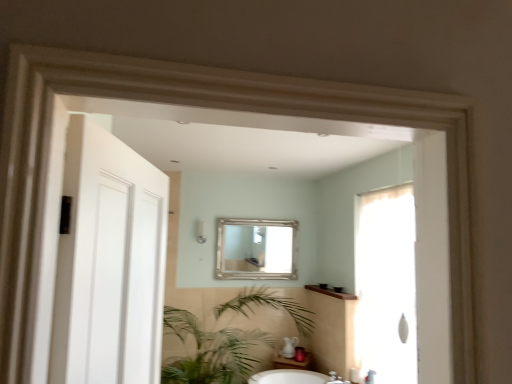
The height and width of the screenshot is (384, 512). What do you see at coordinates (387, 283) in the screenshot?
I see `translucent fabric screen door at right` at bounding box center [387, 283].

Where is `silver metallic mirror at center`? This screenshot has height=384, width=512. silver metallic mirror at center is located at coordinates [x=258, y=248].

Identify the location of green leafy plant at lower center. (211, 351).

Does silver metallic mirror at center have a greater height compared to green leafy plant at lower center?

Incorrect, the height of silver metallic mirror at center is not larger of that of green leafy plant at lower center.

Image resolution: width=512 pixels, height=384 pixels. In order to click on houseplant below the silver metallic mirror at center (from the image's perspective) in this screenshot , I will do `click(211, 351)`.

From the image's perspective, is silver metallic mirror at center positioned above or below green leafy plant at lower center?

silver metallic mirror at center is situated higher than green leafy plant at lower center in the image.

From a real-world perspective, which object stands above the other?

white matte door at left, from a real-world perspective.

Is translucent fabric screen door at right positioned with its back to white matte door at left?

No, translucent fabric screen door at right's orientation is not away from white matte door at left.

Considering the points (390, 292) and (82, 329), which point is in front, point (390, 292) or point (82, 329)?

Point (82, 329)

Can you confirm if translucent fabric screen door at right is positioned to the left of white matte door at left?

No, translucent fabric screen door at right is not to the left of white matte door at left.

Is white matte door at left bigger than silver metallic mirror at center?

Yes, white matte door at left is bigger than silver metallic mirror at center.

The height and width of the screenshot is (384, 512). Identify the location of door below the silver metallic mirror at center (from a real-world perspective). (109, 263).

Considering the sizes of objects white matte door at left and silver metallic mirror at center in the image provided, who is thinner, white matte door at left or silver metallic mirror at center?

Thinner between the two is silver metallic mirror at center.

From a real-world perspective, which object stands above the other?

silver metallic mirror at center.

Which of these two, translucent fabric screen door at right or silver metallic mirror at center, is bigger?

translucent fabric screen door at right.

Considering the positions of objects translucent fabric screen door at right and silver metallic mirror at center in the image provided, who is in front, translucent fabric screen door at right or silver metallic mirror at center?

Positioned in front is translucent fabric screen door at right.

Looking at this image, is silver metallic mirror at center surrounded by translucent fabric screen door at right?

Definitely not — silver metallic mirror at center is not inside translucent fabric screen door at right.

Which object is positioned more to the left, translucent fabric screen door at right or silver metallic mirror at center?

silver metallic mirror at center is more to the left.

Which is less distant, (284, 235) or (381, 266)?

Point (284, 235) is positioned farther from the camera compared to point (381, 266).

Is silver metallic mirror at center bigger than translucent fabric screen door at right?

No, silver metallic mirror at center is not bigger than translucent fabric screen door at right.

Is silver metallic mirror at center facing away from translucent fabric screen door at right?

No, silver metallic mirror at center is not facing the opposite direction of translucent fabric screen door at right.

Would you say silver metallic mirror at center is outside translucent fabric screen door at right?

That's correct, silver metallic mirror at center is outside of translucent fabric screen door at right.

Which of these two, white matte door at left or translucent fabric screen door at right, stands taller?

translucent fabric screen door at right is taller.

The height and width of the screenshot is (384, 512). What are the coordinates of `screen door behind the white matte door at left` in the screenshot? It's located at (387, 283).

Looking at this image, which object is positioned more to the left, white matte door at left or translucent fabric screen door at right?

white matte door at left.

From a real-world perspective, who is located higher, white matte door at left or translucent fabric screen door at right?

white matte door at left.

Is white matte door at left surrounded by silver metallic mirror at center?

No, white matte door at left is not a part of silver metallic mirror at center.

Can you see silver metallic mirror at center touching white matte door at left?

silver metallic mirror at center and white matte door at left are clearly separated.

Which of these two, silver metallic mirror at center or white matte door at left, stands shorter?

silver metallic mirror at center.

Does point (281, 231) come in front of point (150, 354)?

No, it is behind (150, 354).

Image resolution: width=512 pixels, height=384 pixels. I want to click on houseplant in front of the silver metallic mirror at center, so click(x=211, y=351).

Where is `screen door directly beneath the white matte door at left (from a real-world perspective)`? The width and height of the screenshot is (512, 384). screen door directly beneath the white matte door at left (from a real-world perspective) is located at coordinates pos(387,283).

From the image, which object appears to be nearer to green leafy plant at lower center, translucent fabric screen door at right or silver metallic mirror at center?

silver metallic mirror at center lies closer to green leafy plant at lower center than the other object.

From the image, which object appears to be nearer to white matte door at left, silver metallic mirror at center or green leafy plant at lower center?

green leafy plant at lower center is closer to white matte door at left.

From the image, which object appears to be farther from translucent fabric screen door at right, green leafy plant at lower center or white matte door at left?

The object further to translucent fabric screen door at right is white matte door at left.

From the image, which object appears to be nearer to silver metallic mirror at center, white matte door at left or translucent fabric screen door at right?

translucent fabric screen door at right.

Considering their positions, is white matte door at left positioned further to silver metallic mirror at center than green leafy plant at lower center?

white matte door at left is further to silver metallic mirror at center.

From the image, which object appears to be nearer to white matte door at left, translucent fabric screen door at right or green leafy plant at lower center?

translucent fabric screen door at right.

Which object lies nearer to the anchor point translucent fabric screen door at right, white matte door at left or silver metallic mirror at center?

silver metallic mirror at center.

Consider the image. When comparing their distances from white matte door at left, does silver metallic mirror at center or translucent fabric screen door at right seem further?

Among the two, silver metallic mirror at center is located further to white matte door at left.

Locate an element on the screen. Image resolution: width=512 pixels, height=384 pixels. screen door between white matte door at left and silver metallic mirror at center in the front-back direction is located at coordinates (387, 283).

Where is `screen door between white matte door at left and green leafy plant at lower center in the front-back direction`? The height and width of the screenshot is (384, 512). screen door between white matte door at left and green leafy plant at lower center in the front-back direction is located at coordinates pos(387,283).

At what (x,y) coordinates should I click in order to perform the action: click on houseplant between white matte door at left and silver metallic mirror at center along the z-axis. Please return your answer as a coordinate pair (x, y). This screenshot has width=512, height=384. Looking at the image, I should click on (211, 351).

At what (x,y) coordinates should I click in order to perform the action: click on houseplant between translucent fabric screen door at right and silver metallic mirror at center in the front-back direction. Please return your answer as a coordinate pair (x, y). The image size is (512, 384). Looking at the image, I should click on pos(211,351).